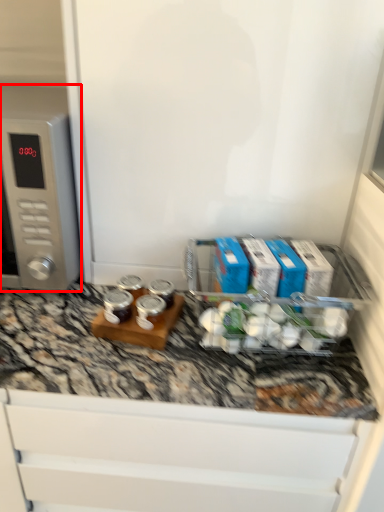
Question: From the image's perspective, where is home appliance (annotated by the red box) located in relation to appliance in the image?

Choices:
 (A) above
 (B) below

Answer: (A)